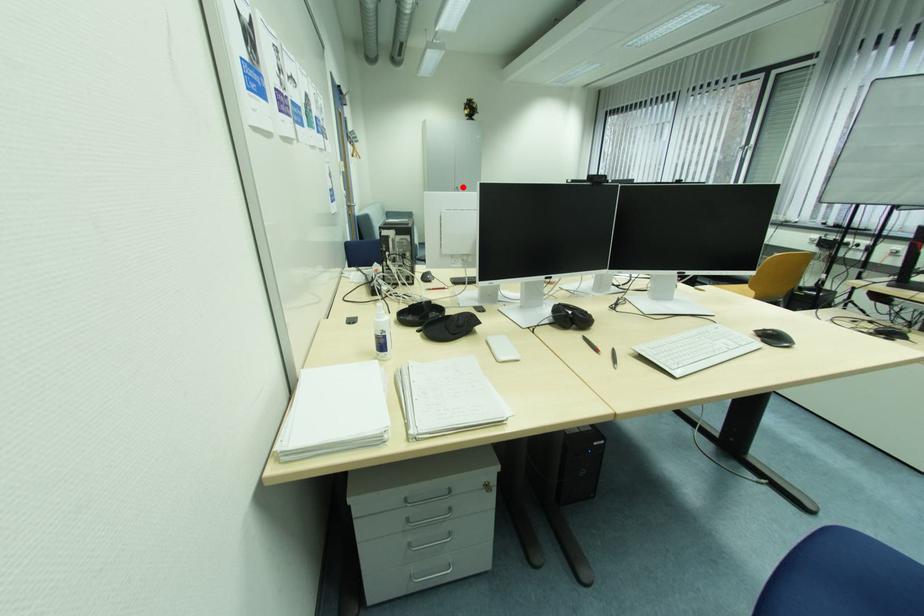
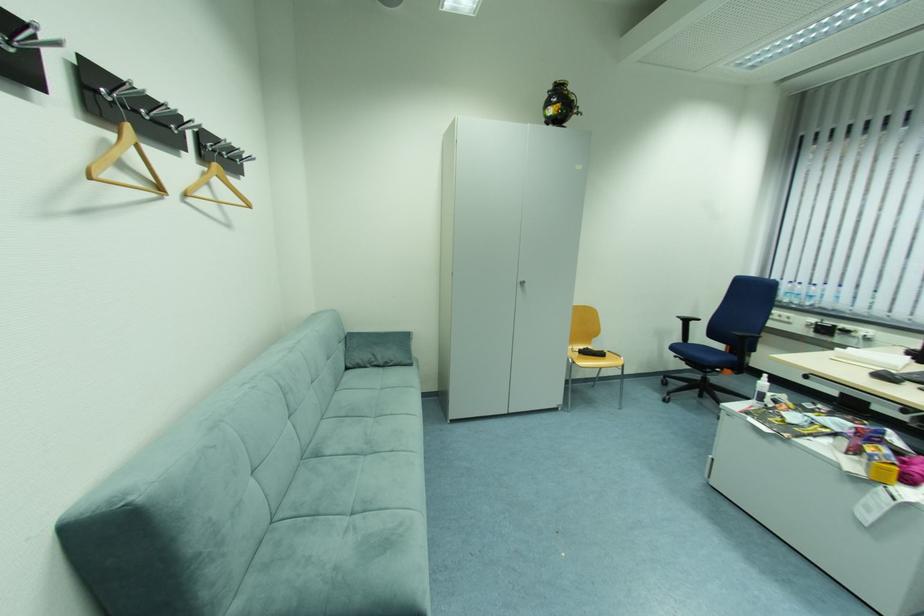
Question: I am providing you with two images of the same scene from different viewpoints. A red point is marked on the first image. Can you still see the location of the red point in image 2?

Choices:
 (A) Yes
 (B) No

Answer: (A)